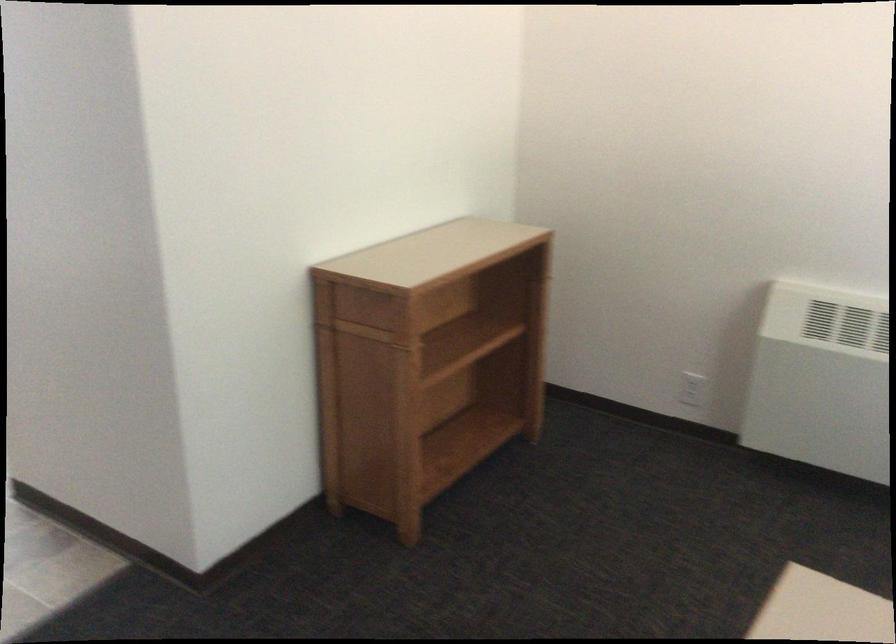
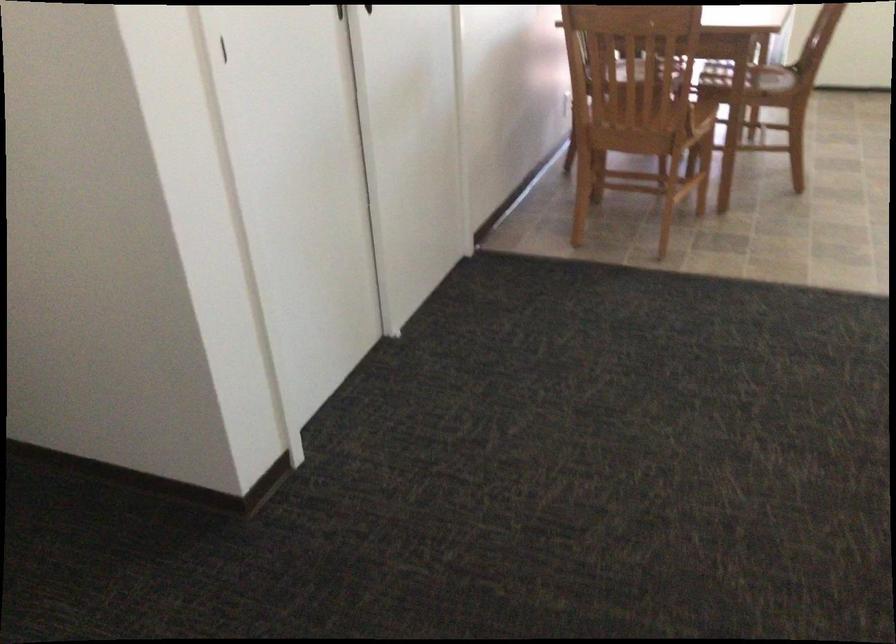
The images are taken continuously from a first-person perspective. In which direction is your viewpoint rotating?

The camera's rotation is toward left-down.